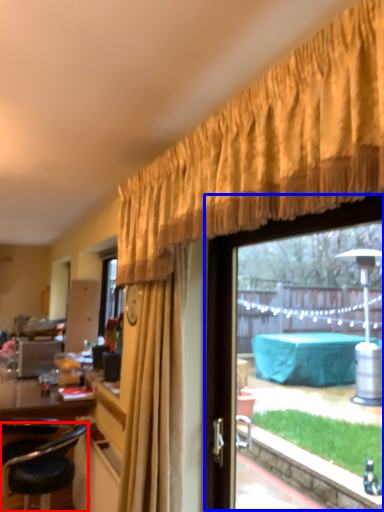
Question: Which object appears closest to the camera in this image, chair (highlighted by a red box) or window (highlighted by a blue box)?

Choices:
 (A) chair
 (B) window

Answer: (B)